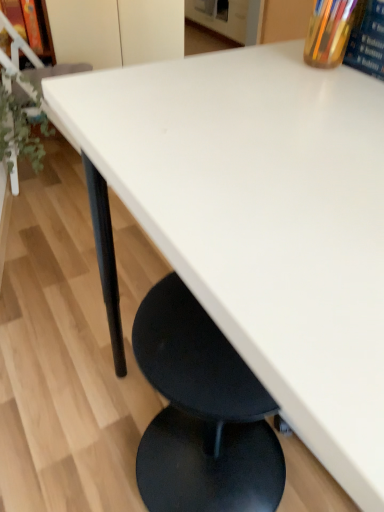
Identify the location of hardcover book at upper right. The image size is (384, 512). (367, 39).

This screenshot has height=512, width=384. What do you see at coordinates (367, 39) in the screenshot?
I see `hardcover book at upper right` at bounding box center [367, 39].

Where is `green leafy plant at left`? The image size is (384, 512). green leafy plant at left is located at coordinates (21, 132).

In order to face matte wood shelf at upper left, should I rotate leftwards or rightwards?

To align with it, rotate left about 21.910°.

Where is `matte wood shelf at upper left`? matte wood shelf at upper left is located at coordinates (44, 34).

You are a GUI agent. You are given a task and a screenshot of the screen. Output one action in this format:
    pyautogui.click(x=<x>, y=<y>)
    Task: Click on the hardcover book at upper right
    
    Given the screenshot: What is the action you would take?
    pyautogui.click(x=367, y=39)

Which of these two, matte wood shelf at upper left or green leafy plant at left, is wider?

Wider between the two is green leafy plant at left.

Which object is further away from the camera taking this photo, matte wood shelf at upper left or green leafy plant at left?

matte wood shelf at upper left is more distant.

From the image's perspective, which object appears higher, matte wood shelf at upper left or green leafy plant at left?

matte wood shelf at upper left.

In the image, is hardcover book at upper right positioned in front of or behind matte wood shelf at upper left?

In the image, hardcover book at upper right appears in front of matte wood shelf at upper left.

From a real-world perspective, between hardcover book at upper right and matte wood shelf at upper left, who is vertically higher?

hardcover book at upper right is physically above.

Which of these two, hardcover book at upper right or matte wood shelf at upper left, stands taller?

Standing taller between the two is matte wood shelf at upper left.

Which of these two, hardcover book at upper right or matte wood shelf at upper left, is smaller?

With smaller size is hardcover book at upper right.

Which is more to the right, matte wood shelf at upper left or translucent glass pen holder at upper right?

translucent glass pen holder at upper right.

From a real-world perspective, is matte wood shelf at upper left above or below translucent glass pen holder at upper right?

From a real-world perspective, matte wood shelf at upper left is physically below translucent glass pen holder at upper right.

Looking at their sizes, would you say matte wood shelf at upper left is wider or thinner than translucent glass pen holder at upper right?

In the image, matte wood shelf at upper left appears to be wider than translucent glass pen holder at upper right.

Can you confirm if matte wood shelf at upper left is taller than translucent glass pen holder at upper right?

Yes.

Choose the correct answer: Is translucent glass pen holder at upper right inside green leafy plant at left or outside it?

translucent glass pen holder at upper right is not inside green leafy plant at left, it's outside.

Is translucent glass pen holder at upper right facing towards green leafy plant at left?

No, translucent glass pen holder at upper right is not turned towards green leafy plant at left.

Looking at this image, which is more to the left, translucent glass pen holder at upper right or green leafy plant at left?

green leafy plant at left.

Are translucent glass pen holder at upper right and green leafy plant at left making contact?

No, translucent glass pen holder at upper right is not touching green leafy plant at left.

Who is shorter, matte wood shelf at upper left or hardcover book at upper right?

hardcover book at upper right is shorter.

From the image's perspective, is matte wood shelf at upper left positioned above or below hardcover book at upper right?

matte wood shelf at upper left is situated higher than hardcover book at upper right in the image.

Is point (23, 25) farther from viewer compared to point (382, 1)?

Yes.

Is there a large distance between matte wood shelf at upper left and hardcover book at upper right?

matte wood shelf at upper left is positioned a significant distance from hardcover book at upper right.

Are hardcover book at upper right and green leafy plant at left beside each other?

They are not placed beside each other.

From the image's perspective, between hardcover book at upper right and green leafy plant at left, which one is located above?

green leafy plant at left, from the image's perspective.

How far apart are hardcover book at upper right and green leafy plant at left?

hardcover book at upper right and green leafy plant at left are 4.60 feet apart from each other.

From a real-world perspective, does translucent glass pen holder at upper right stand above hardcover book at upper right?

Yes.

Is translucent glass pen holder at upper right positioned beyond the bounds of hardcover book at upper right?

translucent glass pen holder at upper right is positioned outside hardcover book at upper right.

Are translucent glass pen holder at upper right and hardcover book at upper right far apart?

No, translucent glass pen holder at upper right is not far from hardcover book at upper right.

Find the location of a particular element. The image size is (384, 512). shelf lying above the green leafy plant at left (from the image's perspective) is located at coordinates (44, 34).

Locate an element on the screen. The height and width of the screenshot is (512, 384). shelf located on the left of hardcover book at upper right is located at coordinates (44, 34).

Looking at the image, which one is located closer to green leafy plant at left, matte wood shelf at upper left or hardcover book at upper right?

Based on the image, matte wood shelf at upper left appears to be nearer to green leafy plant at left.

Looking at the image, which one is located closer to translucent glass pen holder at upper right, hardcover book at upper right or matte wood shelf at upper left?

Among the two, hardcover book at upper right is located nearer to translucent glass pen holder at upper right.

Which object lies further to the anchor point hardcover book at upper right, translucent glass pen holder at upper right or green leafy plant at left?

green leafy plant at left lies further to hardcover book at upper right than the other object.

Based on their spatial positions, is green leafy plant at left or translucent glass pen holder at upper right closer to hardcover book at upper right?

translucent glass pen holder at upper right is closer to hardcover book at upper right.

Based on their spatial positions, is hardcover book at upper right or green leafy plant at left closer to matte wood shelf at upper left?

The object closer to matte wood shelf at upper left is green leafy plant at left.

Estimate the real-world distances between objects in this image. Which object is closer to matte wood shelf at upper left, hardcover book at upper right or translucent glass pen holder at upper right?

Among the two, translucent glass pen holder at upper right is located nearer to matte wood shelf at upper left.

Considering their positions, is translucent glass pen holder at upper right positioned closer to matte wood shelf at upper left than hardcover book at upper right?

Based on the image, translucent glass pen holder at upper right appears to be nearer to matte wood shelf at upper left.

Which object lies further to the anchor point green leafy plant at left, translucent glass pen holder at upper right or matte wood shelf at upper left?

translucent glass pen holder at upper right lies further to green leafy plant at left than the other object.

Find the location of `plant between translucent glass pen holder at upper right and matte wood shelf at upper left in the front-back direction`. plant between translucent glass pen holder at upper right and matte wood shelf at upper left in the front-back direction is located at coordinates (21, 132).

I want to click on plant situated between matte wood shelf at upper left and hardcover book at upper right from left to right, so click(x=21, y=132).

This screenshot has height=512, width=384. Find the location of `bottle between green leafy plant at left and hardcover book at upper right`. bottle between green leafy plant at left and hardcover book at upper right is located at coordinates (329, 32).

This screenshot has width=384, height=512. What are the coordinates of `bottle located between hardcover book at upper right and matte wood shelf at upper left in the depth direction` in the screenshot? It's located at tap(329, 32).